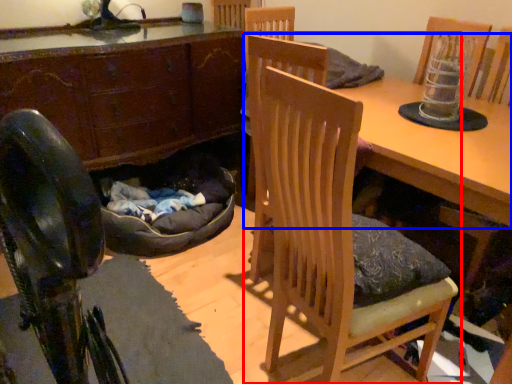
Question: Which point is closer to the camera, chair (highlighted by a red box) or table (highlighted by a blue box)?

Choices:
 (A) chair
 (B) table

Answer: (A)